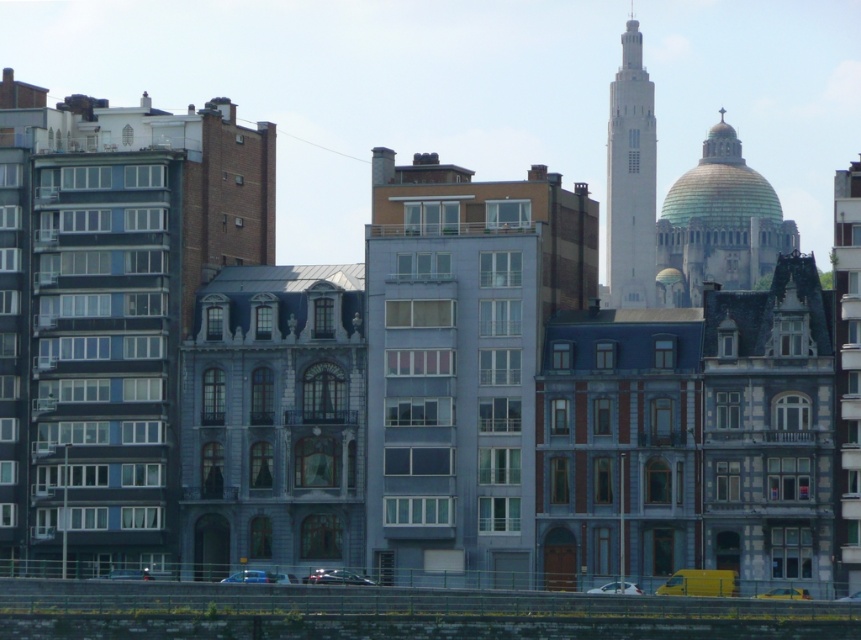
You are a pedestrian standing at the edge of the city square. You see a metallic blue car at center and a metallic silver car at lower center. Which car is nearer to you?

The metallic blue car at center is closer to the viewer than the metallic silver car at lower center, so the metallic blue car at center is nearer to you.

You are a photographer planning to capture the cityscape with both the gold domed dome at upper right and the metallic silver car at lower right in your shot. Given their sizes, which object will appear bigger in the photo?

The gold domed dome at upper right will appear bigger in the photo because it has a larger size compared to the metallic silver car at lower right.